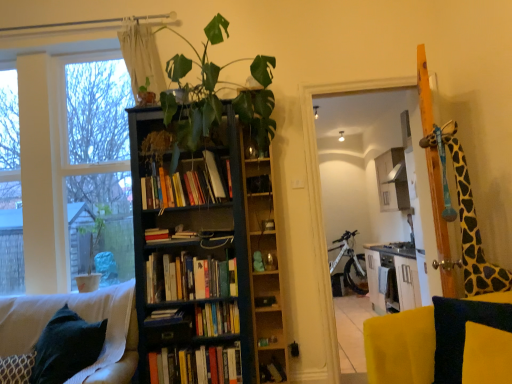
Question: From the image's perspective, is yellow fabric pillow at lower right beneath dark blue wood bookcase at center?

Choices:
 (A) no
 (B) yes

Answer: (B)

Question: Is yellow fabric pillow at lower right wider than dark blue wood bookcase at center?

Choices:
 (A) no
 (B) yes

Answer: (A)

Question: Is dark blue wood bookcase at center at the back of yellow fabric pillow at lower right?

Choices:
 (A) no
 (B) yes

Answer: (A)

Question: Is yellow fabric pillow at lower right not near dark blue wood bookcase at center?

Choices:
 (A) no
 (B) yes

Answer: (B)

Question: Is yellow fabric pillow at lower right not within dark blue wood bookcase at center?

Choices:
 (A) yes
 (B) no

Answer: (A)

Question: Is white sheer curtain at upper left taller or shorter than white matte bicycle at center?

Choices:
 (A) short
 (B) tall

Answer: (A)

Question: From the image's perspective, relative to white matte bicycle at center, is white sheer curtain at upper left above or below?

Choices:
 (A) above
 (B) below

Answer: (A)

Question: From a real-world perspective, relative to white matte bicycle at center, is white sheer curtain at upper left vertically above or below?

Choices:
 (A) below
 (B) above

Answer: (B)

Question: Considering their positions, is white sheer curtain at upper left located in front of or behind white matte bicycle at center?

Choices:
 (A) behind
 (B) front

Answer: (B)

Question: Looking at their shapes, would you say yellow fabric pillow at lower right is wider or thinner than hardcover books at center, the 5th book in the bottom-to-top sequence?

Choices:
 (A) wide
 (B) thin

Answer: (A)

Question: From a real-world perspective, relative to hardcover books at center, the first book viewed from the top, is yellow fabric pillow at lower right vertically above or below?

Choices:
 (A) below
 (B) above

Answer: (A)

Question: Looking at the image, does yellow fabric pillow at lower right seem bigger or smaller compared to hardcover books at center, the 5th book in the bottom-to-top sequence?

Choices:
 (A) small
 (B) big

Answer: (A)

Question: Is yellow fabric pillow at lower right to the left or to the right of hardcover books at center, the 5th book in the bottom-to-top sequence, in the image?

Choices:
 (A) left
 (B) right

Answer: (B)

Question: In terms of size, does velvet dark blue cushion at lower left appear bigger or smaller than white painted wood at left?

Choices:
 (A) big
 (B) small

Answer: (B)

Question: Considering the positions of velvet dark blue cushion at lower left and white painted wood at left in the image, is velvet dark blue cushion at lower left taller or shorter than white painted wood at left?

Choices:
 (A) tall
 (B) short

Answer: (B)